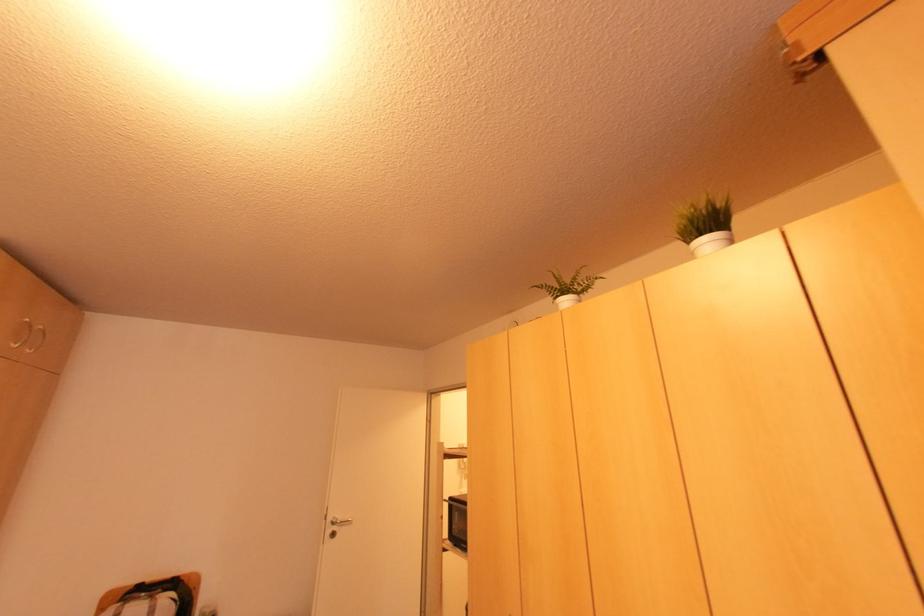
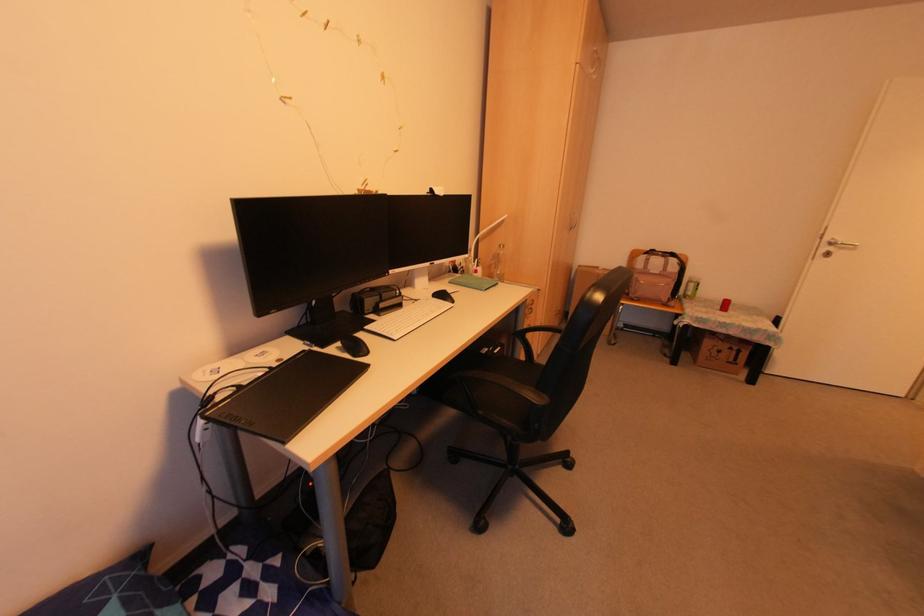
Based on the continuous images, in which direction is the camera rotating?

The rotation direction of the camera is left-down.